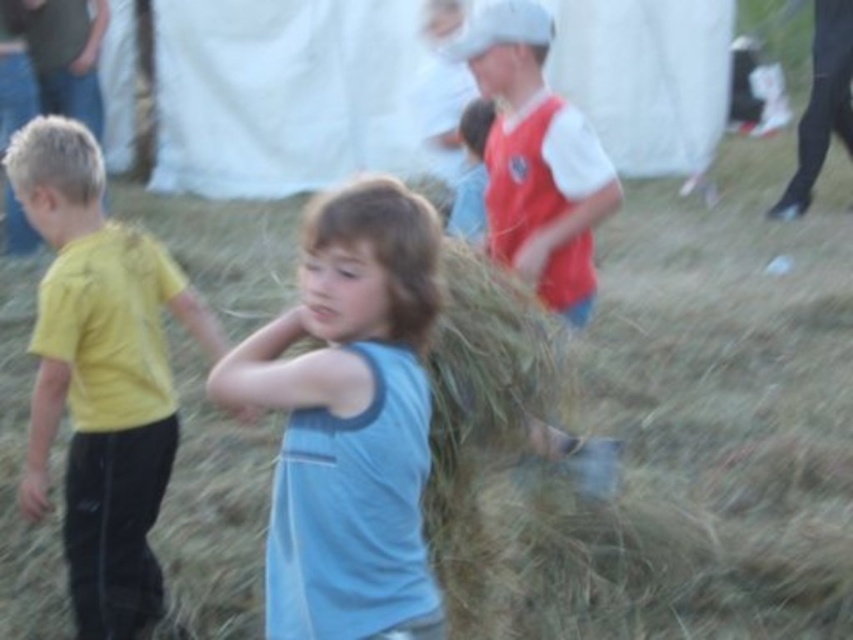
You are a photographer at the event and need to position the light blue cotton shirt at center and the yellow matte shirt at left in a group photo. Which shirt should be placed in the back to ensure both are visible?

The yellow matte shirt at left should be placed in the back because the light blue cotton shirt at center is shorter and can be positioned in front without blocking the view of the taller yellow matte shirt at left.

You are standing at the point marked as point (276, 595), which is 6.98 feet away from you. You want to throw a frisbee to a friend who is 10 feet away from you. Can you reach your friend by throwing the frisbee from your current position?

The distance of point (276, 595) from viewer is 6.98 feet, so yes, you can reach your friend who is 10 feet away since 6.98 feet is less than 10 feet.